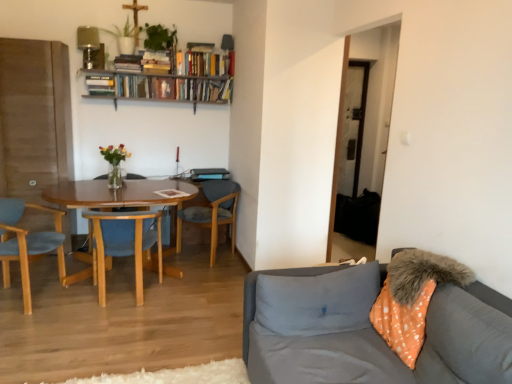
Question: Is the depth of woodenchair at left, which appears as the 2th chair when viewed from the left, less than that of gray fabric pillow at lower right?

Choices:
 (A) no
 (B) yes

Answer: (A)

Question: Is woodenchair at left, which ranks as the second chair in right-to-left order, located outside gray fabric pillow at lower right?

Choices:
 (A) yes
 (B) no

Answer: (A)

Question: Considering the relative sizes of woodenchair at left, which ranks as the second chair in right-to-left order, and gray fabric pillow at lower right in the image provided, is woodenchair at left, which ranks as the second chair in right-to-left order, bigger than gray fabric pillow at lower right?

Choices:
 (A) yes
 (B) no

Answer: (A)

Question: From the image's perspective, is woodenchair at left, which ranks as the second chair in right-to-left order, below gray fabric pillow at lower right?

Choices:
 (A) no
 (B) yes

Answer: (A)

Question: From a real-world perspective, is woodenchair at left, which appears as the 2th chair when viewed from the left, on gray fabric pillow at lower right?

Choices:
 (A) yes
 (B) no

Answer: (B)

Question: Is gray fabric pillow at lower right taller or shorter than wooden bookshelf at upper center?

Choices:
 (A) tall
 (B) short

Answer: (B)

Question: From a real-world perspective, is gray fabric pillow at lower right above or below wooden bookshelf at upper center?

Choices:
 (A) above
 (B) below

Answer: (B)

Question: From the image's perspective, is gray fabric pillow at lower right located above or below wooden bookshelf at upper center?

Choices:
 (A) below
 (B) above

Answer: (A)

Question: Is gray fabric pillow at lower right wider or thinner than wooden bookshelf at upper center?

Choices:
 (A) wide
 (B) thin

Answer: (A)

Question: Do you think gray fabric pillow at lower right is within gray fabric couch at lower right, or outside of it?

Choices:
 (A) outside
 (B) inside

Answer: (B)

Question: From a real-world perspective, is gray fabric pillow at lower right above or below gray fabric couch at lower right?

Choices:
 (A) below
 (B) above

Answer: (B)

Question: From the image's perspective, relative to gray fabric couch at lower right, is gray fabric pillow at lower right above or below?

Choices:
 (A) below
 (B) above

Answer: (B)

Question: Considering the positions of gray fabric pillow at lower right and gray fabric couch at lower right in the image, is gray fabric pillow at lower right bigger or smaller than gray fabric couch at lower right?

Choices:
 (A) small
 (B) big

Answer: (A)

Question: From the image's perspective, is gray fabric couch at lower right positioned above or below wooden bookshelf at upper center?

Choices:
 (A) above
 (B) below

Answer: (B)

Question: In terms of width, does gray fabric couch at lower right look wider or thinner when compared to wooden bookshelf at upper center?

Choices:
 (A) wide
 (B) thin

Answer: (A)